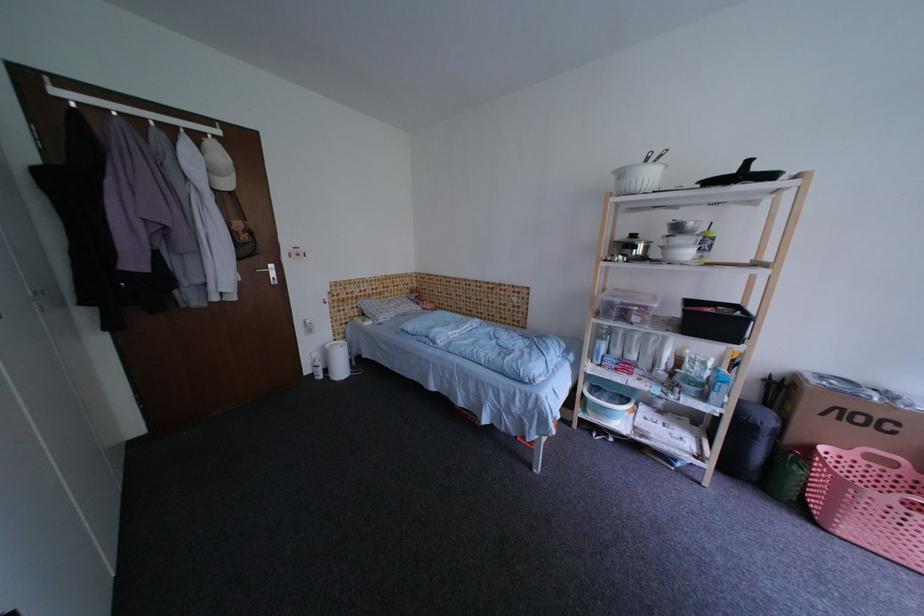
Image resolution: width=924 pixels, height=616 pixels. What do you see at coordinates (270, 273) in the screenshot?
I see `the silver door handle` at bounding box center [270, 273].